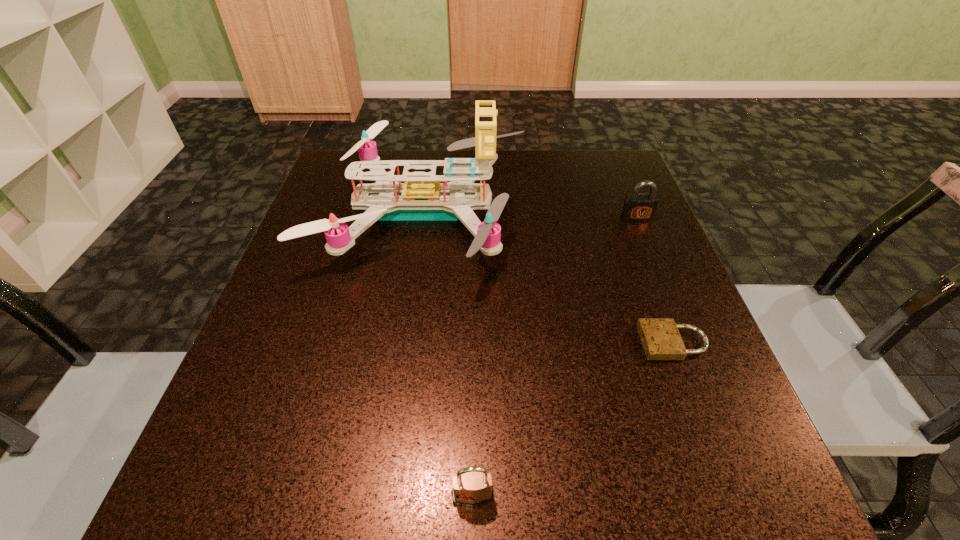
Locate an element on the screen. vacant space situated on the keyhole side of the shortest padlock is located at coordinates (475, 342).

Find the location of a particular element. This screenshot has width=960, height=540. vacant region located 0.210m on the keyhole side of the shortest padlock is located at coordinates (517, 342).

Where is `object that is at the far edge`? This screenshot has height=540, width=960. object that is at the far edge is located at coordinates (420, 198).

Image resolution: width=960 pixels, height=540 pixels. I want to click on object at the near edge, so click(x=471, y=488).

Find the location of a particular element. The width and height of the screenshot is (960, 540). object located in the left edge section of the desktop is located at coordinates (420, 198).

Locate an element on the screen. This screenshot has width=960, height=540. object present at the far left corner is located at coordinates (420, 198).

Identify the location of vacant region at the far edge of the desktop. This screenshot has height=540, width=960. (561, 191).

You are a GUI agent. You are given a task and a screenshot of the screen. Output one action in this format:
    pyautogui.click(x=<x>, y=<y>)
    Task: Click on the free space at the near edge
    The width and height of the screenshot is (960, 540).
    Given the screenshot: What is the action you would take?
    pyautogui.click(x=477, y=510)

In the image, there is a desktop. Identify the location of vacant space at the left edge. Image resolution: width=960 pixels, height=540 pixels. (341, 260).

In the image, there is a desktop. At what (x,y) coordinates should I click in order to perform the action: click on vacant region at the right edge. Please return your answer as a coordinate pair (x, y). The image size is (960, 540). Looking at the image, I should click on [x=651, y=418].